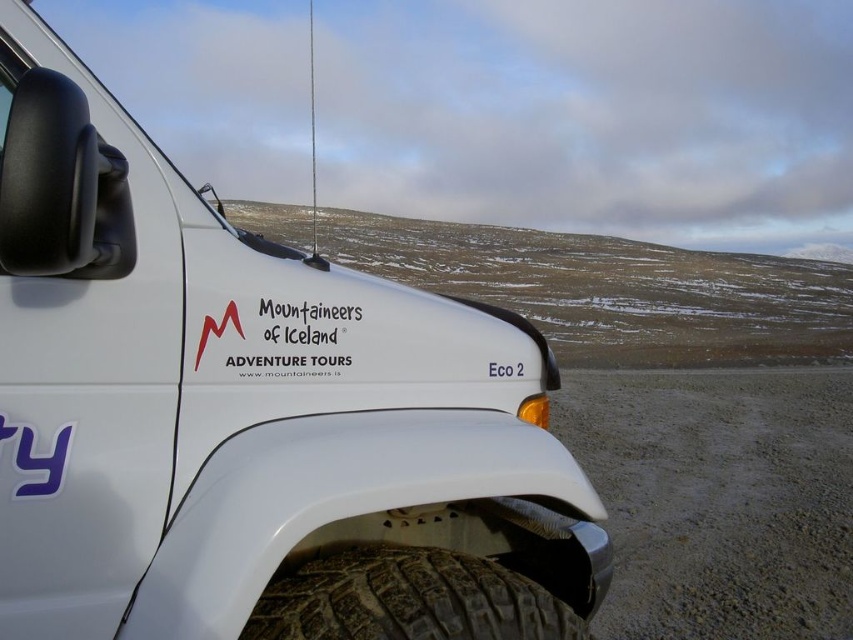
Does gray gravel dirt track at lower right have a lesser height compared to black rubber tire at lower center?

No.

Who is more distant from viewer, (744, 566) or (486, 616)?

The point (744, 566) is more distant.

Where is `gray gravel dirt track at lower right`? gray gravel dirt track at lower right is located at coordinates (718, 497).

Between white matte vehicle at center and black rubber tire at lower center, which one appears on the left side from the viewer's perspective?

From the viewer's perspective, white matte vehicle at center appears more on the left side.

Is point (109, 472) behind point (306, 579)?

No.

Does point (62, 272) lie behind point (397, 612)?

No, (62, 272) is closer to viewer.

Where is `white matte vehicle at center`? Image resolution: width=853 pixels, height=640 pixels. white matte vehicle at center is located at coordinates (251, 413).

What do you see at coordinates (251, 413) in the screenshot? I see `white matte vehicle at center` at bounding box center [251, 413].

Does point (144, 163) come behind point (708, 552)?

No, (144, 163) is closer to viewer.

Is point (579, 545) closer to viewer compared to point (709, 477)?

That is True.

Where is `white matte vehicle at center`? The height and width of the screenshot is (640, 853). white matte vehicle at center is located at coordinates coord(251,413).